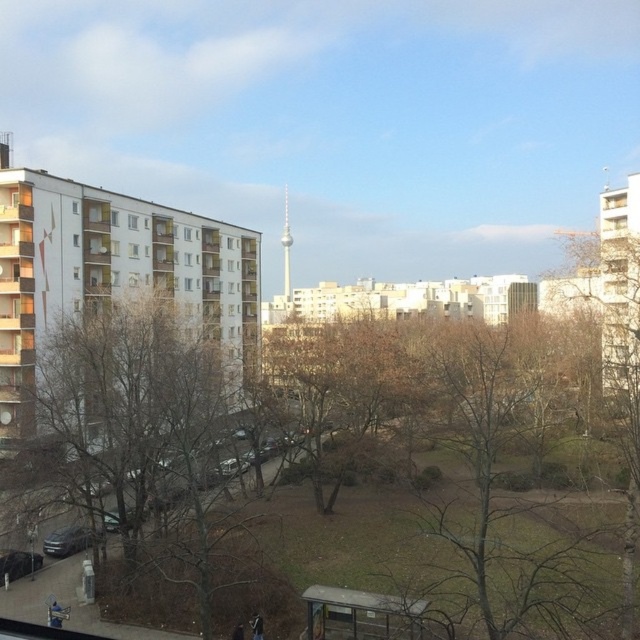
Is the position of brown leafless tree at left less distant than that of silver metallic tv tower at center?

Yes, brown leafless tree at left is in front of silver metallic tv tower at center.

Which is in front, point (172, 484) or point (285, 220)?

Point (172, 484)

The image size is (640, 640). I want to click on brown leafless tree at left, so click(x=141, y=440).

Between brown leafless tree at left and transparent glass window at upper left, which one is positioned lower?

brown leafless tree at left is below.

Is the position of brown leafless tree at left less distant than that of transparent glass window at upper left?

Yes, it is in front of transparent glass window at upper left.

Is point (186, 492) farther from viewer compared to point (77, 202)?

That is False.

Where is `brown leafless tree at left`? The width and height of the screenshot is (640, 640). brown leafless tree at left is located at coordinates (141, 440).

Is brown leafless tree at center positioned in front of white glass window at upper left?

That is True.

Can you confirm if brown leafless tree at center is thinner than white glass window at upper left?

In fact, brown leafless tree at center might be wider than white glass window at upper left.

Does point (554, 392) lie behind point (128, 214)?

No.

Locate an element on the screen. This screenshot has height=640, width=640. brown leafless tree at center is located at coordinates (525, 472).